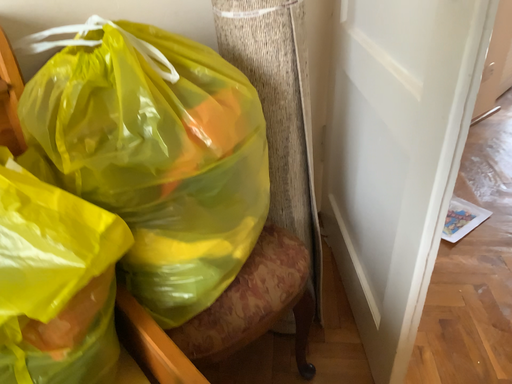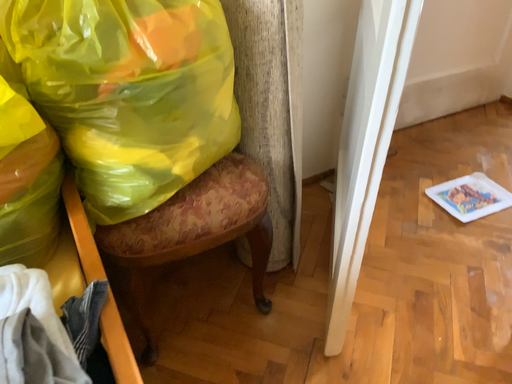
Question: Which way did the camera rotate in the video?

Choices:
 (A) rotated left
 (B) rotated right

Answer: (A)